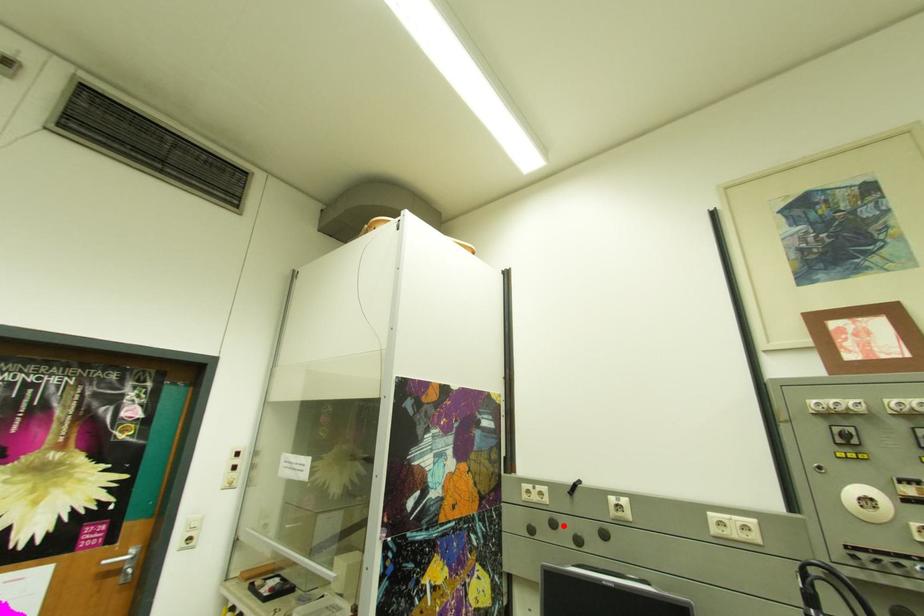
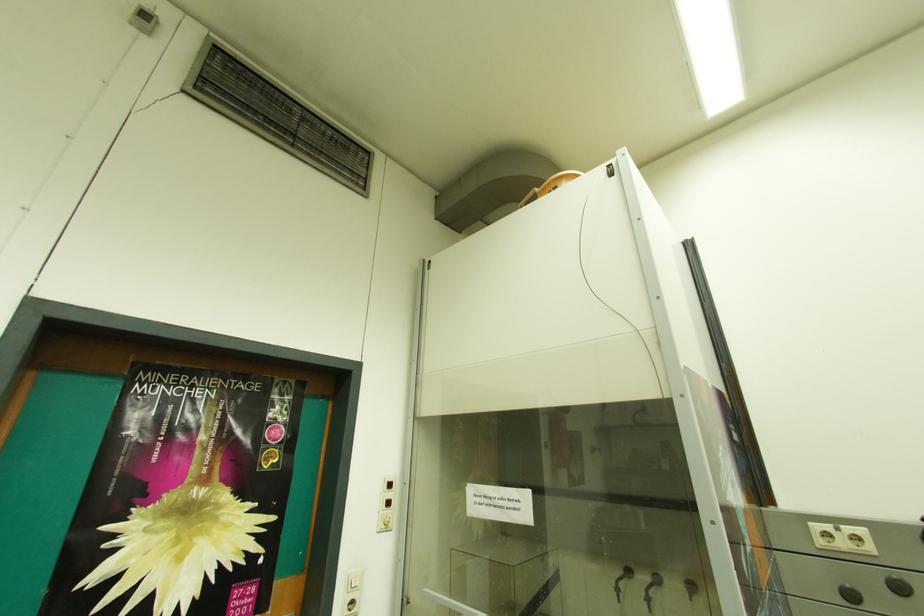
Question: I am providing you with two images of the same scene from different viewpoints. In image1, a red point is highlighted. Considering the same 3D point in image2, which of the following is correct?

Choices:
 (A) It is closer
 (B) It is farther

Answer: (A)